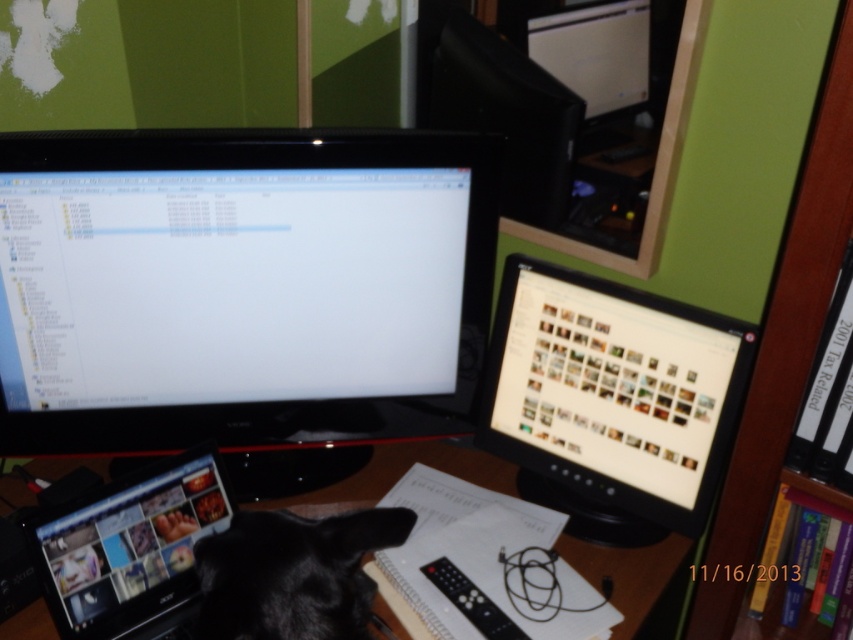
Which is above, wooden bookshelf at right or black fur cat at center?

wooden bookshelf at right is above.

Does wooden bookshelf at right have a larger size compared to black fur cat at center?

Correct, wooden bookshelf at right is larger in size than black fur cat at center.

Is point (738, 595) farther from viewer compared to point (326, 528)?

That is True.

The image size is (853, 640). Find the location of `wooden bookshelf at right`. wooden bookshelf at right is located at coordinates (782, 342).

Is black glossy tablet at lower left bigger than black plastic computer desk at center?

Incorrect, black glossy tablet at lower left is not larger than black plastic computer desk at center.

This screenshot has width=853, height=640. What are the coordinates of `black glossy tablet at lower left` in the screenshot? It's located at (131, 548).

I want to click on black glossy tablet at lower left, so click(x=131, y=548).

In the scene shown: Can you confirm if matte black monitor at center is thinner than black plastic computer desk at center?

Yes, matte black monitor at center is thinner than black plastic computer desk at center.

Is point (701, 320) closer to viewer compared to point (303, 500)?

Yes, point (701, 320) is closer to viewer.

Identify the location of matte black monitor at center. The width and height of the screenshot is (853, 640). (611, 401).